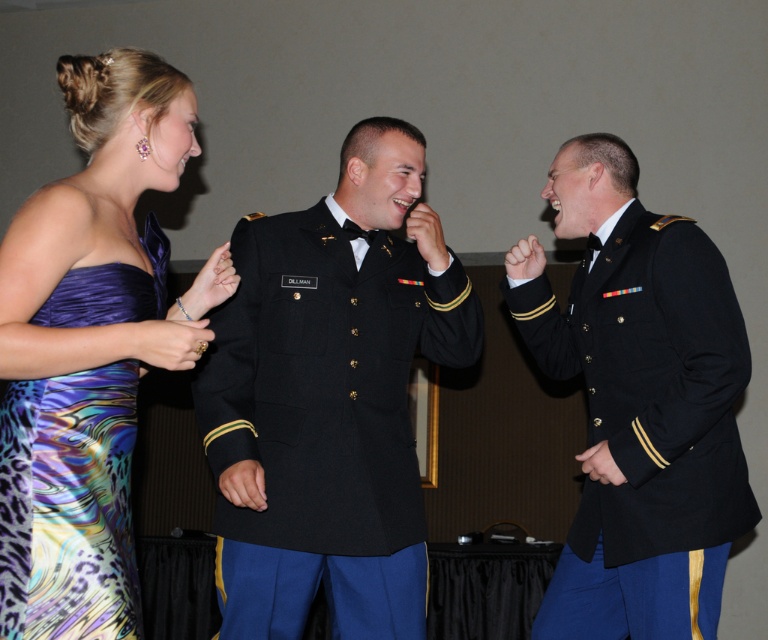
The height and width of the screenshot is (640, 768). Describe the element at coordinates (330, 397) in the screenshot. I see `black wool military uniform at center` at that location.

Looking at this image, is black wool military uniform at center thinner than matte black uniform at center?

Incorrect, black wool military uniform at center's width is not less than matte black uniform at center's.

Find the location of a particular element. This screenshot has width=768, height=640. black wool military uniform at center is located at coordinates (330, 397).

Does matte black uniform at center have a lesser height compared to multicolored satin dress at left?

Incorrect, matte black uniform at center's height does not fall short of multicolored satin dress at left's.

Is matte black uniform at center to the left of multicolored satin dress at left from the viewer's perspective?

Incorrect, matte black uniform at center is not on the left side of multicolored satin dress at left.

You are a GUI agent. You are given a task and a screenshot of the screen. Output one action in this format:
    pyautogui.click(x=<x>, y=<y>)
    Task: Click on the matte black uniform at center
    Image resolution: width=768 pixels, height=640 pixels.
    Given the screenshot: What is the action you would take?
    pyautogui.click(x=639, y=403)

Is black wool military uniform at center thinner than shiny satin dress at left?

No.

Is black wool military uniform at center positioned before shiny satin dress at left?

No.

Between point (404, 576) and point (22, 588), which one is positioned behind?

Positioned behind is point (404, 576).

In order to click on black wool military uniform at center in this screenshot , I will do `click(330, 397)`.